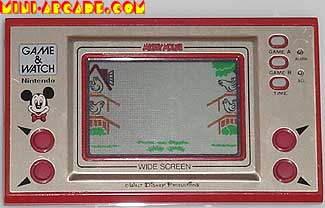
Locate an element on the screen. This screenshot has height=208, width=325. display screen is located at coordinates (166, 101).